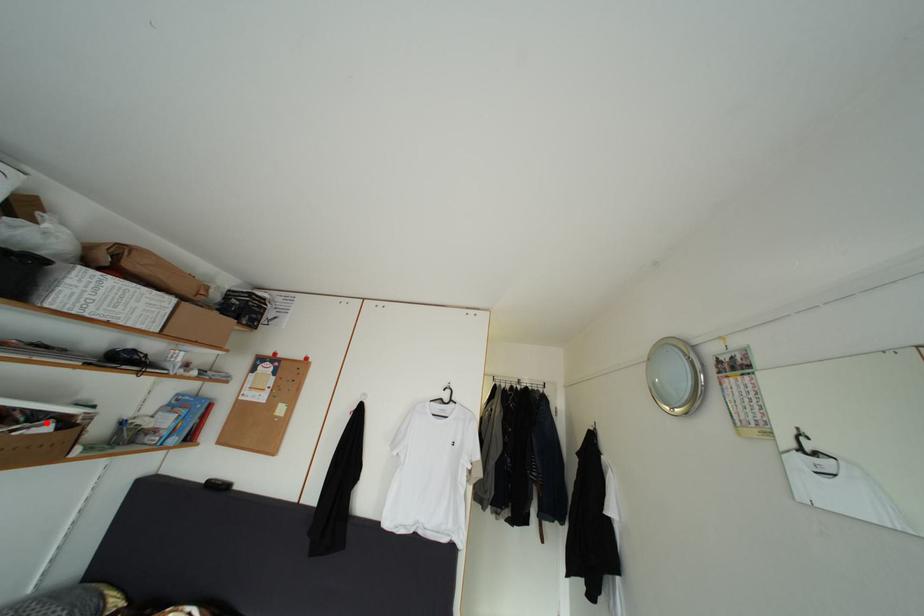
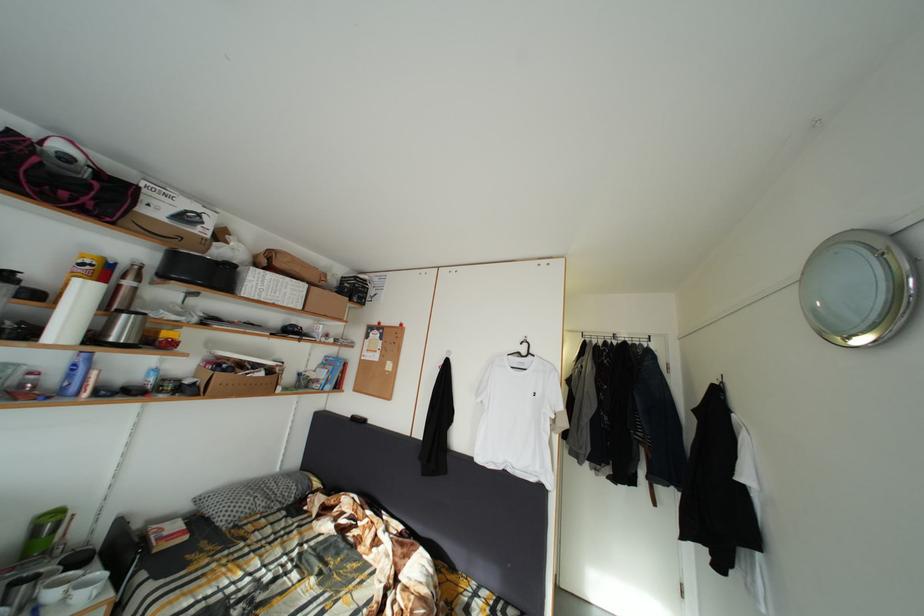
Where in the second image is the point corresponding to the highlighted location from the first image?

(264, 373)